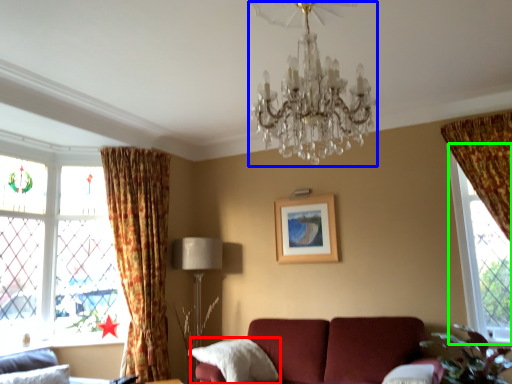
Question: Which is nearer to the pillow (highlighted by a red box)? chandelier (highlighted by a blue box) or window (highlighted by a green box).

Choices:
 (A) chandelier
 (B) window

Answer: (B)